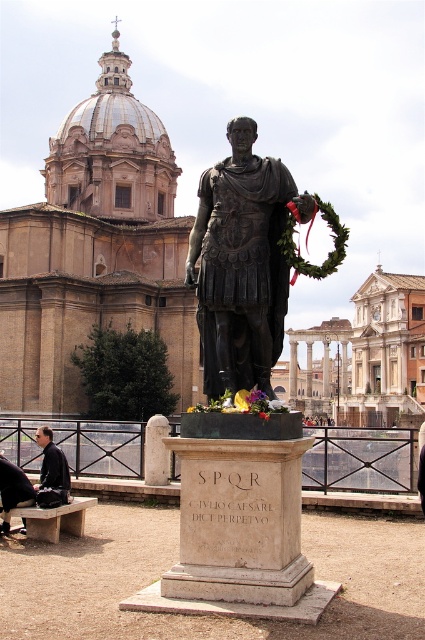
Question: Can you confirm if bronze statue at center is smaller than dark brown leather jacket at lower left?

Choices:
 (A) yes
 (B) no

Answer: (A)

Question: Which object appears closest to the camera in this image?

Choices:
 (A) dark blue jeans at lower left
 (B) dark brown leather jacket at lower left
 (C) polished bronze statue at center

Answer: (C)

Question: Which of the following is the farthest from the observer?

Choices:
 (A) polished bronze statue at center
 (B) light gray stone bench at lower left
 (C) bronze statue at center

Answer: (B)

Question: Is bronze statue at center further to the viewer compared to light gray stone bench at lower left?

Choices:
 (A) yes
 (B) no

Answer: (B)

Question: Is bronze statue at center to the left of dark brown leather jacket at lower left from the viewer's perspective?

Choices:
 (A) no
 (B) yes

Answer: (A)

Question: Which point is closer to the camera?

Choices:
 (A) (2, 529)
 (B) (258, 333)

Answer: (B)